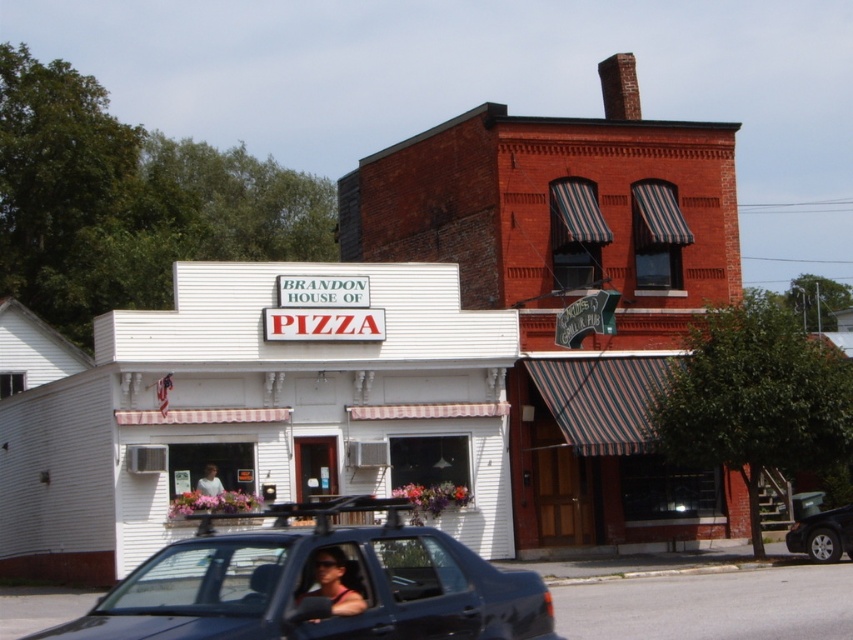
You are standing at the origin point of the scene. Which direction should you move to reach the white woodshed at center?

The white woodshed at center is located at coordinates 0.642 on the x axis and 0.304 on the y axis, so you should move to the right and slightly forward to reach it.

You are a delivery person needing to park your black rubber car at lower right. There is a white woodshed at center in the way. Can you fit your car next to the woodshed?

The white woodshed at center is larger in size than the black rubber car at lower right. Since the woodshed is bigger, there might not be enough space to park the car next to it. It depends on the exact dimensions, but the car could potentially fit if positioned carefully.